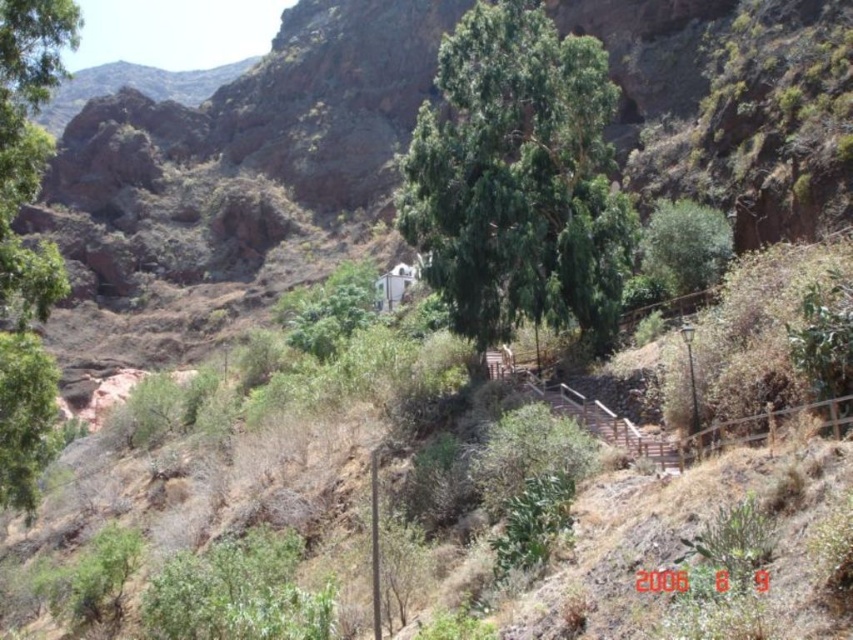
In the scene shown: Which is more to the right, green leafy tree at center or green leafy tree at left?

Positioned to the right is green leafy tree at center.

Describe the element at coordinates (519, 179) in the screenshot. I see `green leafy tree at center` at that location.

Find the location of a particular element. This screenshot has width=853, height=640. green leafy tree at center is located at coordinates (519, 179).

Who is shorter, green leafy tree at left or green leafy tree at upper right?

green leafy tree at upper right is shorter.

Can you confirm if green leafy tree at left is thinner than green leafy tree at upper right?

No, green leafy tree at left is not thinner than green leafy tree at upper right.

Which is behind, point (9, 16) or point (642, 262)?

Point (642, 262)

The width and height of the screenshot is (853, 640). Identify the location of green leafy tree at left. (25, 243).

Does green leafy tree at center appear over green leafy tree at upper right?

Yes.

Can you confirm if green leafy tree at center is positioned to the left of green leafy tree at upper right?

Yes, green leafy tree at center is to the left of green leafy tree at upper right.

Identify the location of green leafy tree at center. (519, 179).